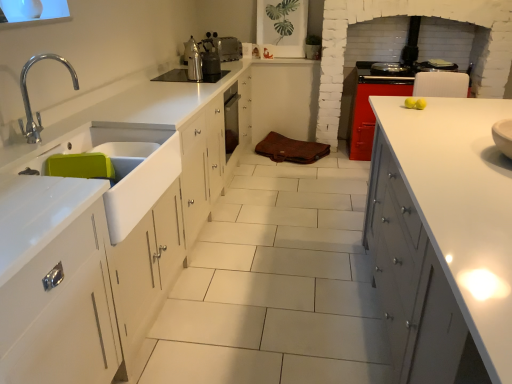
Question: Is shiny metallic stove at upper right surrounding white glossy sink at left?

Choices:
 (A) yes
 (B) no

Answer: (B)

Question: Does shiny metallic stove at upper right appear on the left side of white glossy sink at left?

Choices:
 (A) no
 (B) yes

Answer: (A)

Question: Is shiny metallic stove at upper right positioned with its back to white glossy sink at left?

Choices:
 (A) no
 (B) yes

Answer: (A)

Question: Considering the relative sizes of shiny metallic stove at upper right and white glossy sink at left in the image provided, is shiny metallic stove at upper right smaller than white glossy sink at left?

Choices:
 (A) yes
 (B) no

Answer: (A)

Question: From the image's perspective, is shiny metallic stove at upper right over white glossy sink at left?

Choices:
 (A) yes
 (B) no

Answer: (A)

Question: Is white glossy cabinet at right, marked as the 1th cabinetry in a front-to-back arrangement, taller or shorter than shiny metallic stove at upper right?

Choices:
 (A) tall
 (B) short

Answer: (A)

Question: In terms of width, does white glossy cabinet at right, which appears as the 1th cabinetry when ordered from the bottom, look wider or thinner when compared to shiny metallic stove at upper right?

Choices:
 (A) wide
 (B) thin

Answer: (A)

Question: Does point (424, 188) appear closer or farther from the camera than point (388, 66)?

Choices:
 (A) farther
 (B) closer

Answer: (B)

Question: Relative to shiny metallic stove at upper right, is white glossy cabinet at right, marked as the second cabinetry in a top-to-bottom arrangement, in front or behind?

Choices:
 (A) front
 (B) behind

Answer: (A)

Question: From a real-world perspective, is black glass cooktop at upper center physically located above or below polished chrome tap at left?

Choices:
 (A) above
 (B) below

Answer: (B)

Question: Is black glass cooktop at upper center wider or thinner than polished chrome tap at left?

Choices:
 (A) wide
 (B) thin

Answer: (A)

Question: Is black glass cooktop at upper center in front of or behind polished chrome tap at left in the image?

Choices:
 (A) front
 (B) behind

Answer: (B)

Question: From the image's perspective, is black glass cooktop at upper center above or below polished chrome tap at left?

Choices:
 (A) above
 (B) below

Answer: (A)

Question: Would you say metallic silver kettle at center, marked as the 2th appliance in a top-to-bottom arrangement, is inside or outside white glossy sink at left?

Choices:
 (A) outside
 (B) inside

Answer: (A)

Question: From the image's perspective, is metallic silver kettle at center, marked as the 2th appliance in a top-to-bottom arrangement, positioned above or below white glossy sink at left?

Choices:
 (A) above
 (B) below

Answer: (A)